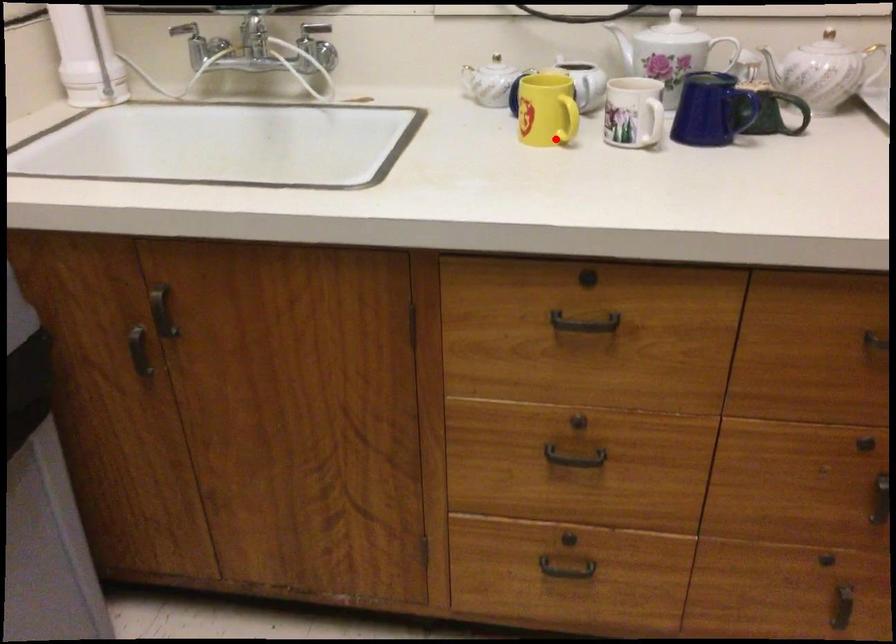
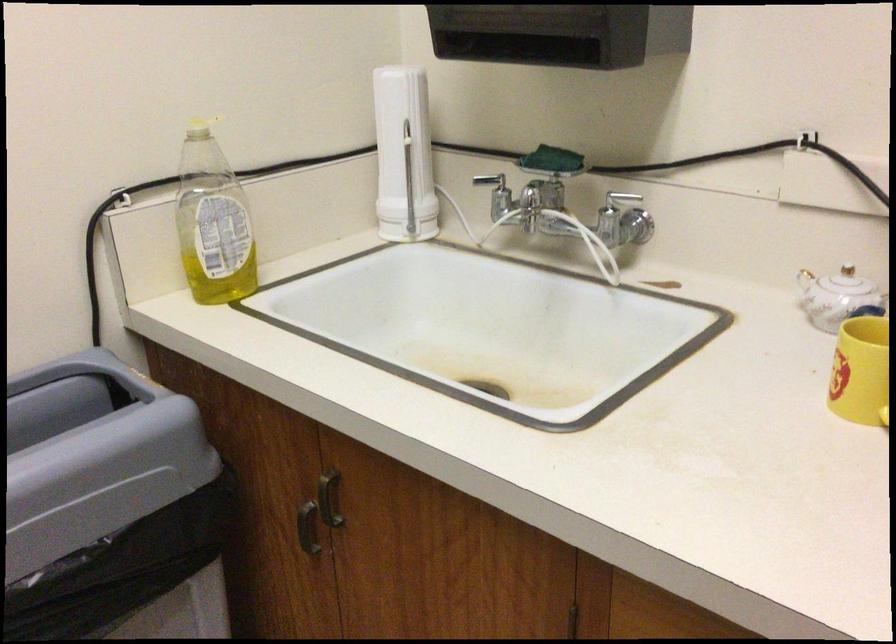
Question: I am providing you with two images of the same scene from different viewpoints. In image1, a red point is highlighted. Considering the same 3D point in image2, which of the following is correct?

Choices:
 (A) It is closer
 (B) It is farther

Answer: (A)